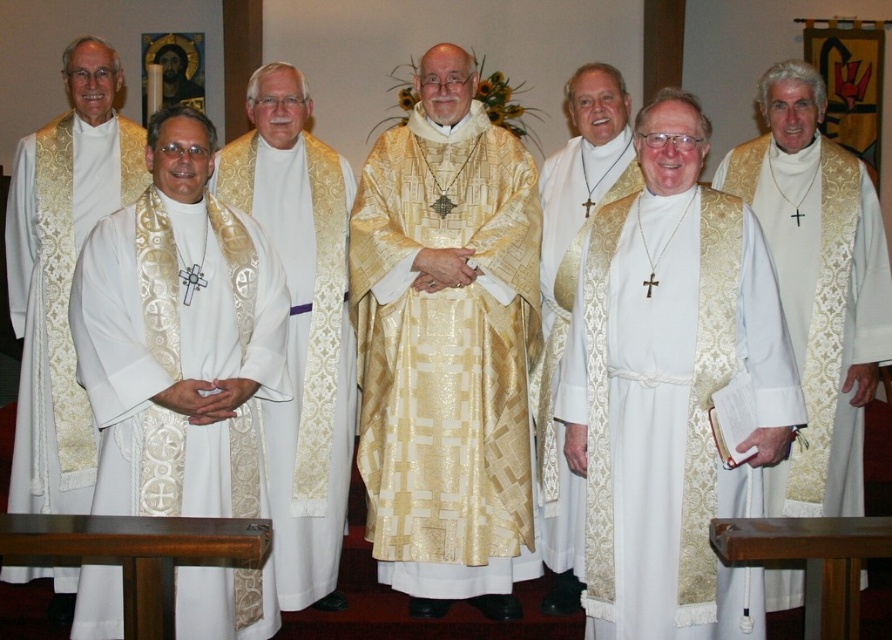
Can you confirm if white textured fabric at center is smaller than white textured vestment at left?

No, white textured fabric at center is not smaller than white textured vestment at left.

Is point (169, 288) in front of point (21, 170)?

That is True.

Where is `white textured fabric at center`? This screenshot has height=640, width=892. white textured fabric at center is located at coordinates (178, 355).

You are a GUI agent. You are given a task and a screenshot of the screen. Output one action in this format:
    pyautogui.click(x=<x>, y=<y>)
    Task: Click on the white textured fabric at center
    
    Given the screenshot: What is the action you would take?
    pyautogui.click(x=178, y=355)

Who is positioned more to the left, white damask vestment at center or white textured vestment at center?

white textured vestment at center is more to the left.

Who is positioned more to the right, white damask vestment at center or white textured vestment at center?

Positioned to the right is white damask vestment at center.

Image resolution: width=892 pixels, height=640 pixels. I want to click on white damask vestment at center, so click(x=670, y=410).

Who is higher up, white textured vestment at center or gold textured vestment at center?

gold textured vestment at center is higher up.

Is white textured vestment at center positioned before gold textured vestment at center?

No, it is not.

Looking at this image, who is more distant from viewer, (255, 188) or (725, 157)?

The point (725, 157) is behind.

Where is `white textured vestment at center`? white textured vestment at center is located at coordinates (301, 326).